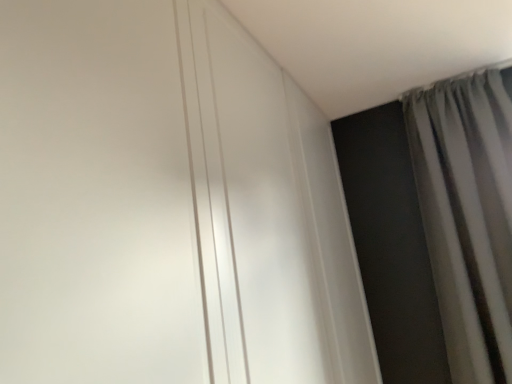
Question: From a real-world perspective, relative to white glossy door at upper center, is gray fabric curtain at upper right vertically above or below?

Choices:
 (A) below
 (B) above

Answer: (A)

Question: Considering the positions of gray fabric curtain at upper right and white glossy door at upper center in the image, is gray fabric curtain at upper right bigger or smaller than white glossy door at upper center?

Choices:
 (A) small
 (B) big

Answer: (B)

Question: In terms of height, does gray fabric curtain at upper right look taller or shorter compared to white glossy door at upper center?

Choices:
 (A) tall
 (B) short

Answer: (A)

Question: Is point (169, 286) positioned closer to the camera than point (453, 84)?

Choices:
 (A) farther
 (B) closer

Answer: (B)

Question: In terms of size, does white glossy door at upper center appear bigger or smaller than gray fabric curtain at upper right?

Choices:
 (A) small
 (B) big

Answer: (A)

Question: From the image's perspective, relative to gray fabric curtain at upper right, is white glossy door at upper center above or below?

Choices:
 (A) below
 (B) above

Answer: (B)

Question: In the image, is white glossy door at upper center positioned in front of or behind gray fabric curtain at upper right?

Choices:
 (A) front
 (B) behind

Answer: (A)